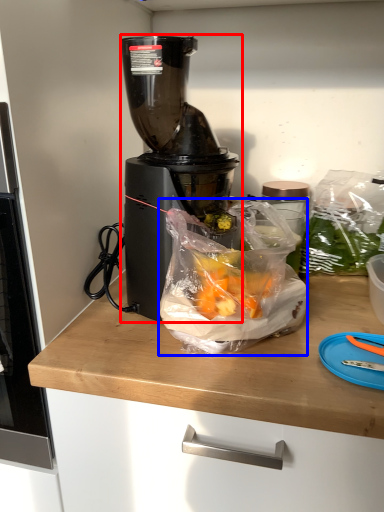
Question: Which of the following is the farthest to the observer, blender (highlighted by a red box) or waste (highlighted by a blue box)?

Choices:
 (A) blender
 (B) waste

Answer: (A)